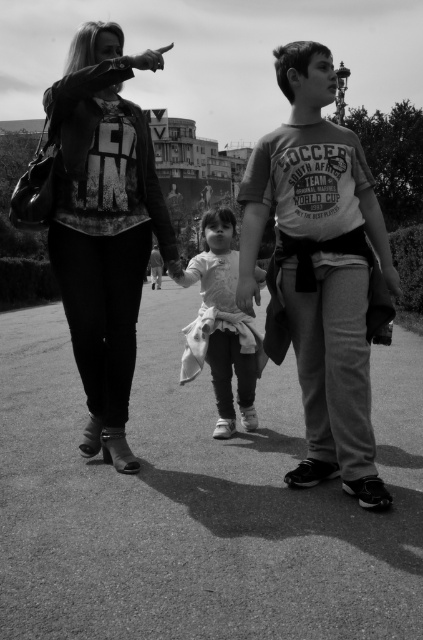
Question: Among these objects, which one is nearest to the camera?

Choices:
 (A) matte gray hoodie at center
 (B) matte black jacket at left
 (C) matte black jacket at upper left
 (D) matte gray t-shirt at center

Answer: (C)

Question: Can you confirm if white cotton dress at center is bigger than matte gray hoodie at center?

Choices:
 (A) no
 (B) yes

Answer: (A)

Question: Which of the following is the closest to the observer?

Choices:
 (A) (65, 264)
 (B) (214, 298)
 (C) (151, 257)
 (D) (293, 481)

Answer: (D)

Question: Which of the following is the farthest from the observer?

Choices:
 (A) (71, 157)
 (B) (359, 444)

Answer: (A)

Question: Considering the relative positions of matte black jacket at left and white cotton dress at center in the image provided, where is matte black jacket at left located with respect to white cotton dress at center?

Choices:
 (A) below
 (B) above

Answer: (B)

Question: Does matte black jacket at upper left have a lesser width compared to matte gray hoodie at center?

Choices:
 (A) no
 (B) yes

Answer: (B)